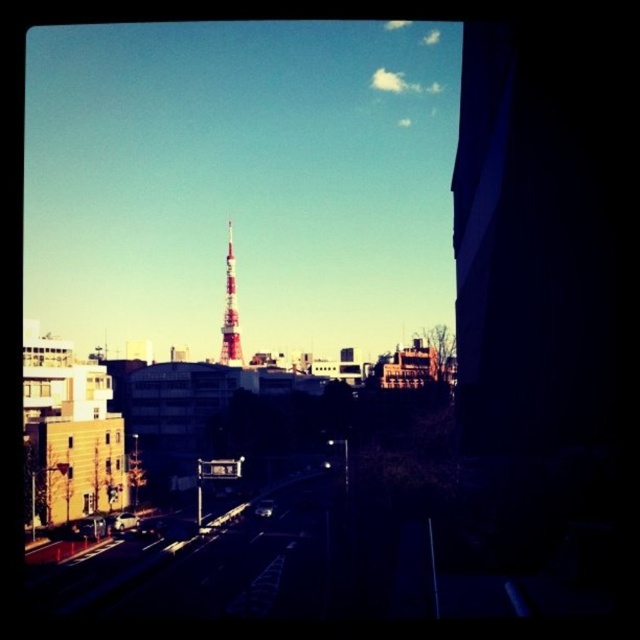
You are a delivery driver who needs to turn onto the smooth asphalt road at lower left. What coordinate should you aim for to make the turn?

The smooth asphalt road at lower left is located at coordinate point (124,566), so you should aim for that point to make the turn.

You are a pedestrian standing on the smooth asphalt road at lower left and want to walk towards the red painted metal tower at center. Which direction should you head to reach the tower?

To reach the red painted metal tower at center from the smooth asphalt road at lower left, you should head to the left since the road is on the right side of the tower.

You are a city planner analyzing the city layout. You need to determine the relative lengths of the smooth asphalt road at lower left and the red painted metal tower at center. Which one is longer?

The red painted metal tower at center is longer than the smooth asphalt road at lower left.